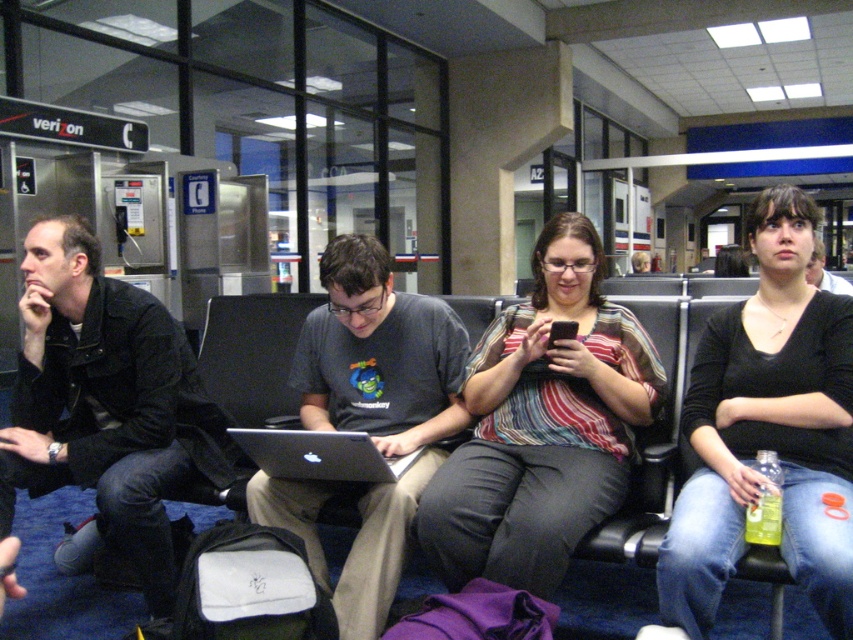
Question: Estimate the real-world distances between objects in this image. Which object is farther from the matte gray shirt at center?

Choices:
 (A) black jersey at center
 (B) dark gray t-shirt at center
 (C) silver/black plastic laptop at center

Answer: (B)

Question: Can you confirm if striped fabric shirt at center is positioned below black jersey at center?

Choices:
 (A) yes
 (B) no

Answer: (B)

Question: Which object appears farthest from the camera in this image?

Choices:
 (A) silver/black plastic laptop at center
 (B) matte gray shirt at center
 (C) black jersey at center
 (D) black leather jacket at left

Answer: (D)

Question: Does striped fabric shirt at center appear under silver/black plastic laptop at center?

Choices:
 (A) no
 (B) yes

Answer: (A)

Question: Does black jersey at center have a greater width compared to black leather jacket at left?

Choices:
 (A) no
 (B) yes

Answer: (A)

Question: Which point is farther to the camera?

Choices:
 (A) (837, 291)
 (B) (41, 392)
 (C) (709, 547)
 (D) (299, 440)

Answer: (A)